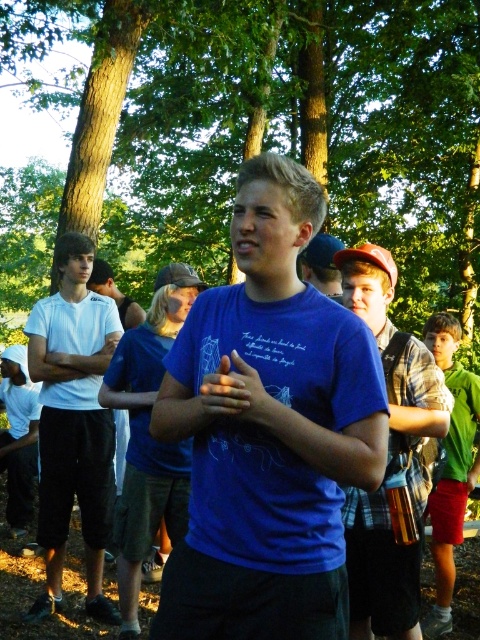
Question: From the image, what is the correct spatial relationship of blue cotton shirt at center in relation to green fabric shirt at center?

Choices:
 (A) right
 (B) left

Answer: (B)

Question: Can you confirm if white matte t-shirt at left is positioned above matte blue t-shirt at center?

Choices:
 (A) yes
 (B) no

Answer: (B)

Question: Estimate the real-world distances between objects in this image. Which object is farther from the green fabric shirt at center?

Choices:
 (A) blue matte shirt at center
 (B) green leafy tree at center

Answer: (B)

Question: Which of the following is the farthest from the observer?

Choices:
 (A) (51, 45)
 (B) (451, 596)

Answer: (A)

Question: Can you confirm if blue cotton shirt at center is positioned below green fabric shirt at center?

Choices:
 (A) no
 (B) yes

Answer: (A)

Question: Among these points, which one is farthest from the camera?

Choices:
 (A) (193, 493)
 (B) (121, 614)
 (C) (456, 348)

Answer: (C)